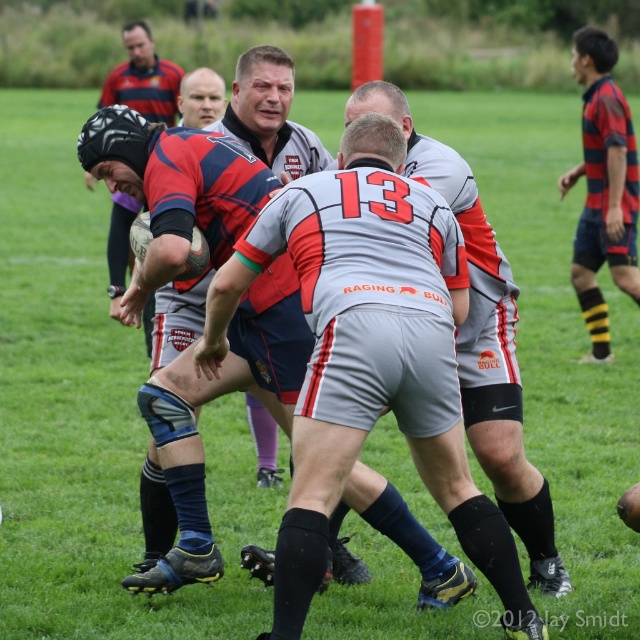
Does matte gray shorts at center appear on the right side of striped jersey at center?

No, matte gray shorts at center is not to the right of striped jersey at center.

Between matte gray shorts at center and striped jersey at center, which one has less height?

striped jersey at center

Who is more forward, (397, 189) or (630, 202)?

Positioned in front is point (397, 189).

Find the location of `matte gray shorts at center`. matte gray shorts at center is located at coordinates (369, 355).

I want to click on matte gray shorts at center, so click(x=369, y=355).

What do you see at coordinates (369, 355) in the screenshot? This screenshot has width=640, height=640. I see `matte gray shorts at center` at bounding box center [369, 355].

The width and height of the screenshot is (640, 640). In order to click on matte gray shorts at center in this screenshot , I will do `click(369, 355)`.

Can you confirm if gray matte shorts at center is thinner than striped jersey at center?

No, gray matte shorts at center is not thinner than striped jersey at center.

Can you confirm if gray matte shorts at center is positioned above striped jersey at center?

Incorrect, gray matte shorts at center is not positioned above striped jersey at center.

Is point (484, 253) farther from viewer compared to point (600, 257)?

No.

The image size is (640, 640). Find the location of `gray matte shorts at center`. gray matte shorts at center is located at coordinates (483, 340).